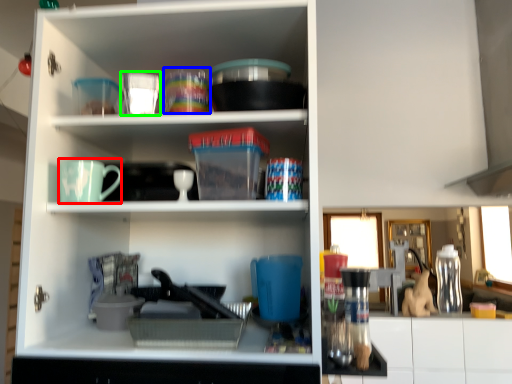
Question: Which object is positioned closest to mug (highlighted by a red box)? Select from tableware (highlighted by a blue box) and tableware (highlighted by a green box).

Choices:
 (A) tableware
 (B) tableware

Answer: (B)